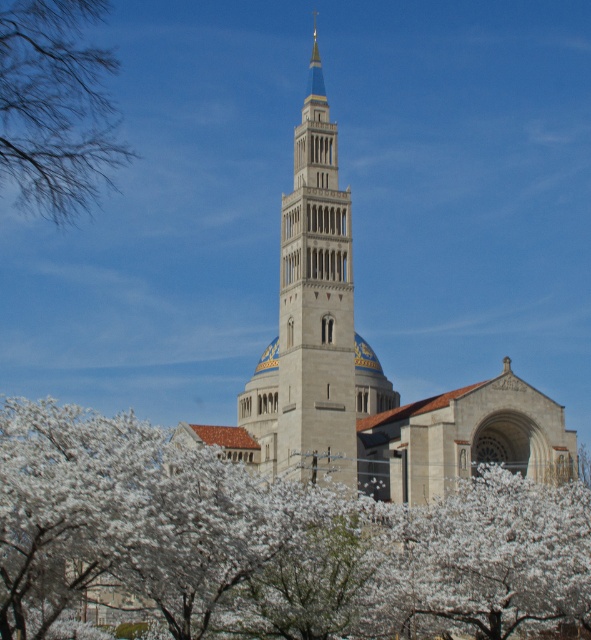
You are an architect assessing the proportions of the scene. Given the white blossoms at center and the beige stone bell tower at center, which object occupies a larger horizontal space in the image?

The white blossoms at center occupy a larger horizontal space since their width surpasses that of the beige stone bell tower at center.

You are an architect planning to install a large statue in front of the beige stone church at center. The statue requires a space that is wider than the current width of the bare branches at upper left. Based on the scene, can the statue be placed here?

The beige stone church at center might be wider than bare branches at upper left. If the church is indeed wider, then the statue requiring space wider than the bare branches could fit, but there is uncertainty due to the comparison being uncertain.

You are standing in front of the grand architectural structure and want to determine which of the two points, point (164, 472) or point (346, 196), is closer to you. Based on the structure and the cherry blossom trees in the foreground, which point is nearer?

Point (164, 472) is closer to the viewer than point (346, 196).